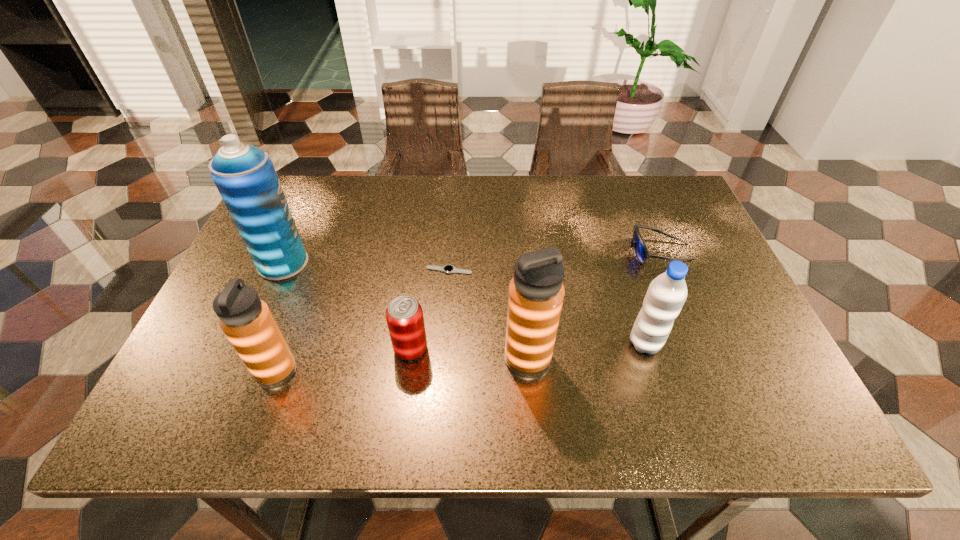
Locate an element on the screen. This screenshot has height=540, width=960. aerosol can at the left edge is located at coordinates (244, 175).

At what (x,y) coordinates should I click in order to perform the action: click on object situated at the right edge. Please return your answer as a coordinate pair (x, y). The height and width of the screenshot is (540, 960). Looking at the image, I should click on (641, 252).

Where is `object at the near left corner`? object at the near left corner is located at coordinates (247, 322).

Where is `vacant space at the far edge of the desktop`? Image resolution: width=960 pixels, height=540 pixels. vacant space at the far edge of the desktop is located at coordinates pos(455,195).

The width and height of the screenshot is (960, 540). I want to click on vacant space at the near edge of the desktop, so click(x=297, y=389).

You are a GUI agent. You are given a task and a screenshot of the screen. Output one action in this format:
    pyautogui.click(x=<x>, y=<y>)
    Task: Click on the vacant space at the right edge of the desktop
    
    Given the screenshot: What is the action you would take?
    pyautogui.click(x=705, y=258)

This screenshot has width=960, height=540. I want to click on free space that is in between the can and the aerosol can, so click(347, 306).

Identify the location of vacant space that is in between the can and the third object from right to left. (469, 354).

Locate an element on the screen. free space between the can and the third object from right to left is located at coordinates (469, 354).

Find the location of `free space between the fifth object from left to right and the left thermos bottle`. free space between the fifth object from left to right and the left thermos bottle is located at coordinates tap(402, 364).